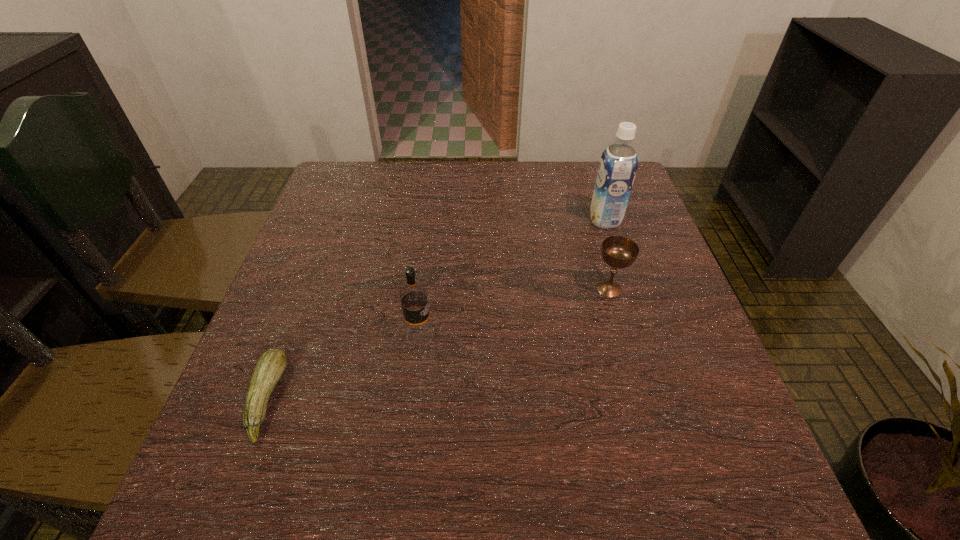
At what (x,y) coordinates should I click in order to perform the action: click on free space at the right edge. Please return your answer as a coordinate pair (x, y). The width and height of the screenshot is (960, 540). Looking at the image, I should click on (686, 348).

You are a GUI agent. You are given a task and a screenshot of the screen. Output one action in this format:
    pyautogui.click(x=<x>, y=<y>)
    Task: Click on the vacant space at the far left corner
    The width and height of the screenshot is (960, 540).
    Given the screenshot: What is the action you would take?
    (345, 200)

Where is `free space that is in between the second shortest object and the shortest object`? The image size is (960, 540). free space that is in between the second shortest object and the shortest object is located at coordinates (438, 343).

Identify the location of vacant area between the nearest object and the farthest object. (436, 309).

This screenshot has width=960, height=540. Find the location of `free space that is in between the shortest object and the chalice`. free space that is in between the shortest object and the chalice is located at coordinates (438, 343).

Locate an element on the screen. The height and width of the screenshot is (540, 960). vacant space in between the second object from left to right and the farthest object is located at coordinates (513, 279).

At what (x,y) coordinates should I click in order to perform the action: click on free space that is in between the second tallest object and the leftmost object. Please return your answer as a coordinate pair (x, y). Looking at the image, I should click on (343, 368).

Image resolution: width=960 pixels, height=540 pixels. I want to click on vacant space that's between the tallest object and the second tallest object, so click(513, 279).

Identify the location of unoccupied area between the chalice and the nearest object. The width and height of the screenshot is (960, 540). (438, 343).

Where is `free space between the second farthest object and the second nearest object`? free space between the second farthest object and the second nearest object is located at coordinates (515, 313).